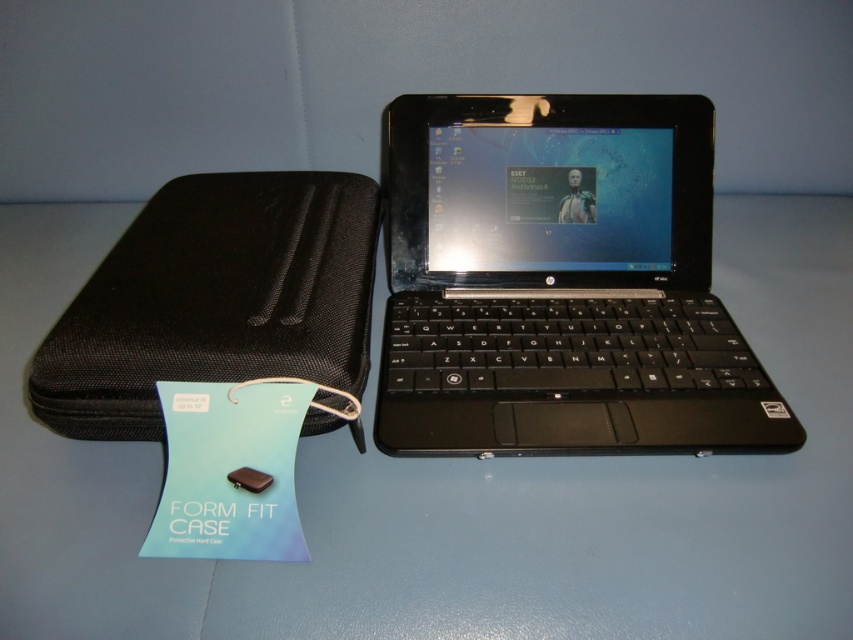
Which is more to the right, black plastic laptop at center or black fabric case at left?

black plastic laptop at center is more to the right.

Does point (676, 157) come in front of point (251, 243)?

No, it is not.

Locate an element on the screen. The image size is (853, 640). black plastic laptop at center is located at coordinates (560, 284).

Does point (843, 602) lie in front of point (84, 401)?

Yes, point (843, 602) is closer to viewer.

Between point (718, 566) and point (216, 250), which one is positioned behind?

Point (216, 250)

Does point (688, 472) come behind point (68, 356)?

Yes, it is behind point (68, 356).

Locate an element on the screen. This screenshot has width=853, height=640. blue matte table at center is located at coordinates (457, 488).

Consider the image. Is blue matte table at center above black plastic laptop at center?

Actually, blue matte table at center is below black plastic laptop at center.

Between blue matte table at center and black plastic laptop at center, which one has less height?

With less height is black plastic laptop at center.

Is point (694, 477) positioned in front of point (497, 264)?

That is True.

Where is `blue matte table at center`? blue matte table at center is located at coordinates (457, 488).